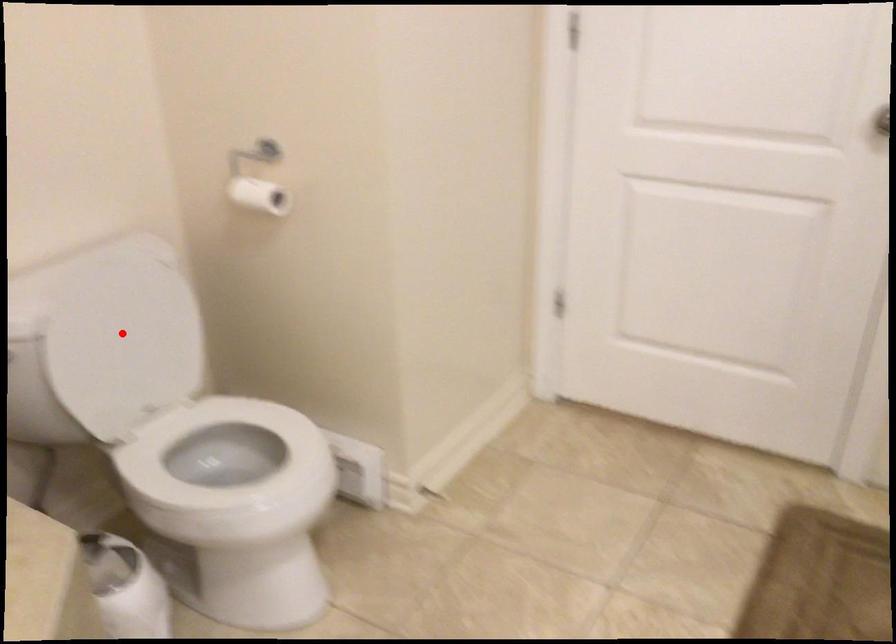
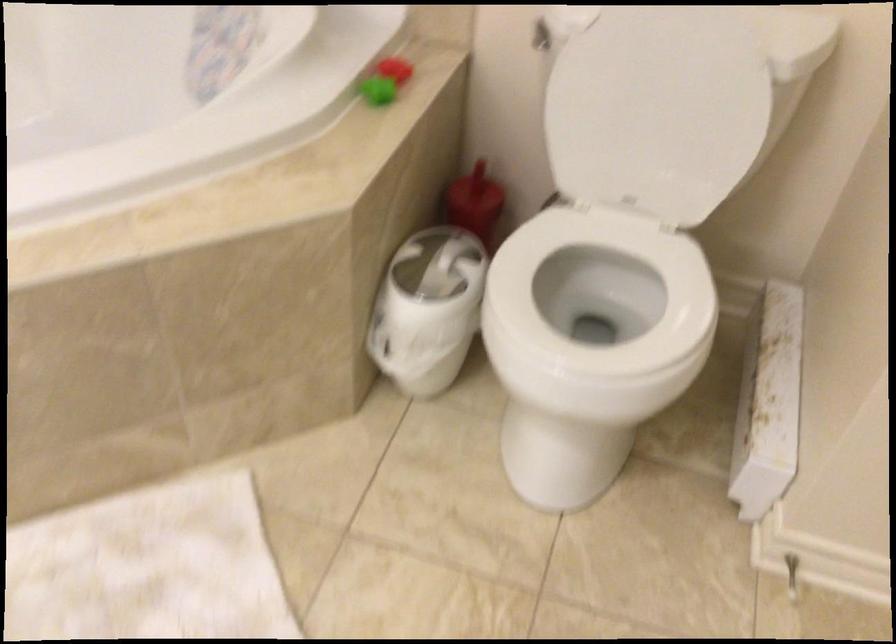
Where in the second image is the point corresponding to the highlighted location from the first image?

(657, 109)